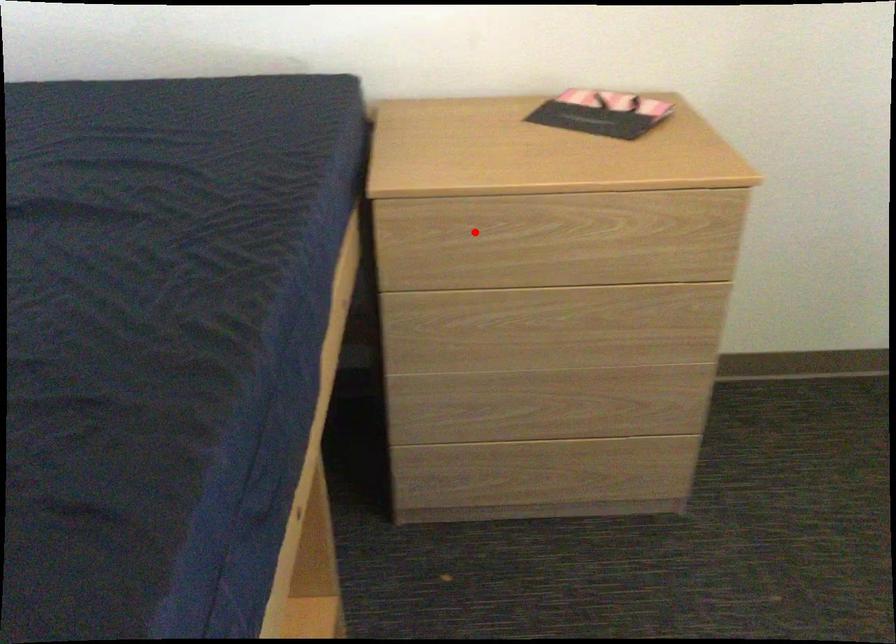
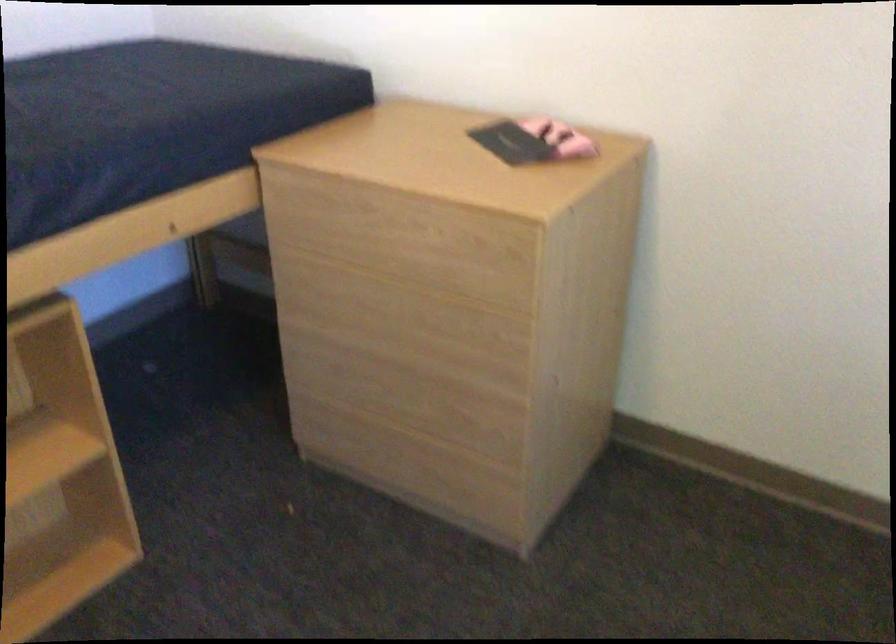
In the second image, find the point that corresponds to the highlighted location in the first image.

(324, 209)